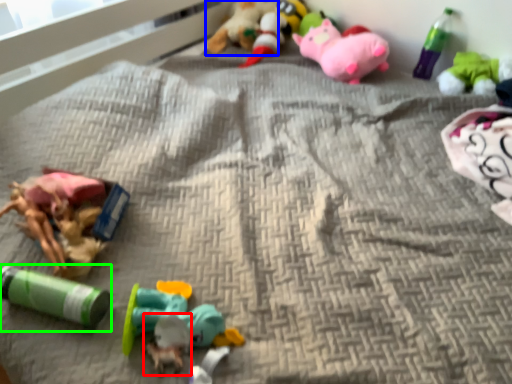
Question: Which is farther away from toy (highlighted by a red box)? toy (highlighted by a blue box) or toy (highlighted by a green box)?

Choices:
 (A) toy
 (B) toy

Answer: (A)